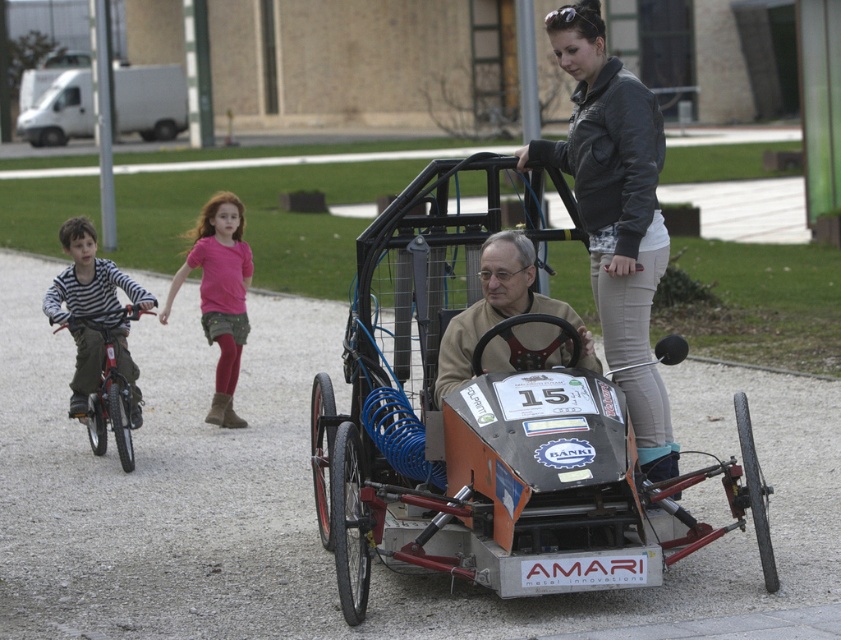
Can you confirm if white matte van at upper left is shorter than metallic silver bicycle at left?

Incorrect, white matte van at upper left's height does not fall short of metallic silver bicycle at left's.

Is point (154, 118) more distant than point (104, 344)?

Yes, it is behind point (104, 344).

Is point (59, 112) positioned in front of point (104, 400)?

That is False.

The image size is (841, 640). Find the location of `white matte van at upper left`. white matte van at upper left is located at coordinates pyautogui.click(x=151, y=100).

Between point (566, 16) and point (218, 204), which one is positioned in front?

Point (566, 16) is more forward.

Is leather jacket at center above pink fabric skirt at center?

Incorrect, leather jacket at center is not positioned above pink fabric skirt at center.

Describe the element at coordinates (611, 177) in the screenshot. I see `leather jacket at center` at that location.

Identify the location of leather jacket at center. The image size is (841, 640). (611, 177).

Which of these two, matte beige shirt at center or metallic silver bicycle at left, stands shorter?

matte beige shirt at center is shorter.

Does matte beige shirt at center have a lesser height compared to metallic silver bicycle at left?

Yes.

Is point (530, 348) closer to viewer compared to point (104, 372)?

Yes.

At what (x,y) coordinates should I click in order to perform the action: click on matte beige shirt at center. Please return your answer as a coordinate pair (x, y). The width and height of the screenshot is (841, 640). Looking at the image, I should click on (501, 308).